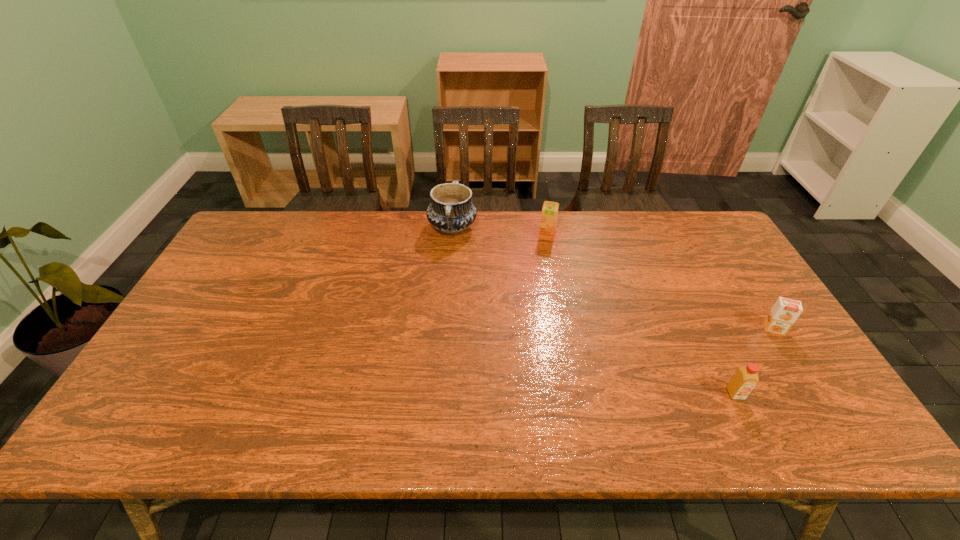
You are a GUI agent. You are given a task and a screenshot of the screen. Output one action in this format:
    pyautogui.click(x=<x>, y=<y>)
    Task: Click on the pottery
    The image size is (960, 540).
    Given the screenshot: What is the action you would take?
    pyautogui.click(x=451, y=211)

Locate an element on the screen. The width and height of the screenshot is (960, 540). the tallest orange juice is located at coordinates (549, 214).

Find the location of a particular element. This screenshot has width=960, height=540. the farthest orange juice is located at coordinates (549, 214).

Where is `the nearest object`? the nearest object is located at coordinates (745, 378).

Find the location of a particular element. The width and height of the screenshot is (960, 540). the second orange juice from right to left is located at coordinates (745, 378).

Locate an element on the screen. the rightmost object is located at coordinates (784, 313).

Find the location of a particular element. the rightmost orange juice is located at coordinates (784, 313).

I want to click on free space located 0.370m on the left of the leftmost object, so click(x=321, y=228).

I want to click on vacant space located 0.360m on the front of the leftmost orange juice, so click(x=563, y=323).

Image resolution: width=960 pixels, height=540 pixels. What are the coordinates of `free space located on the front and back of the nearest orange juice` in the screenshot? It's located at 758,442.